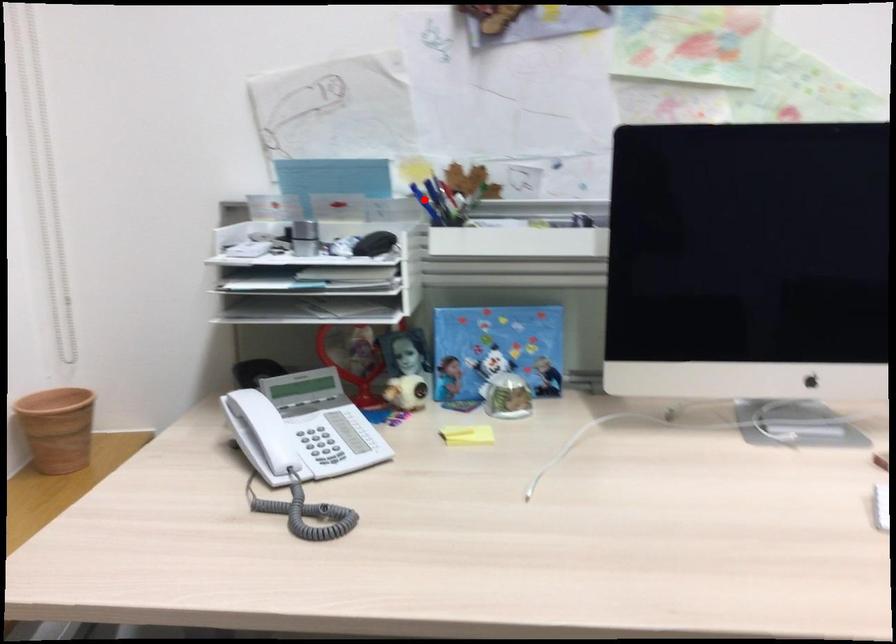
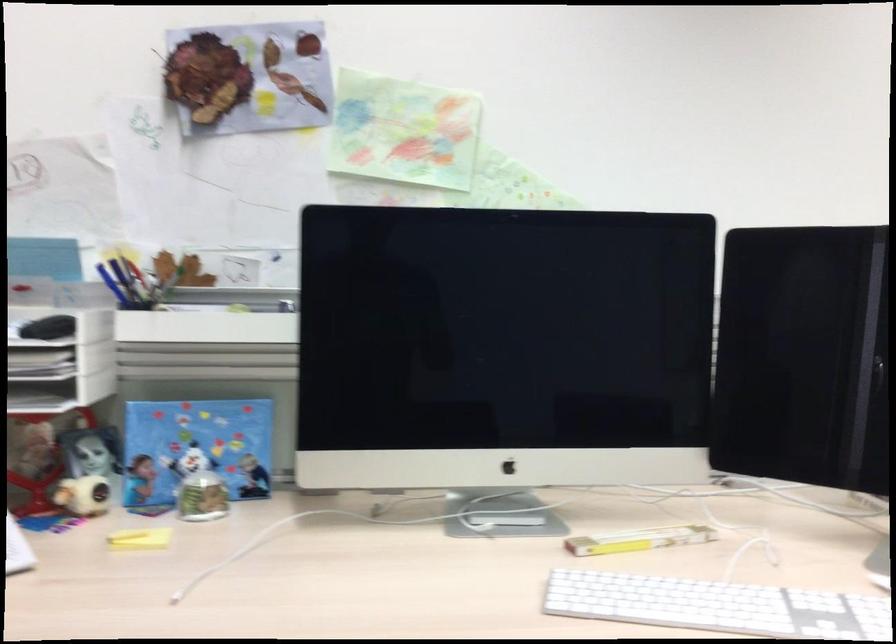
The point at the highlighted location is marked in the first image. Where is the corresponding point in the second image?

(113, 285)